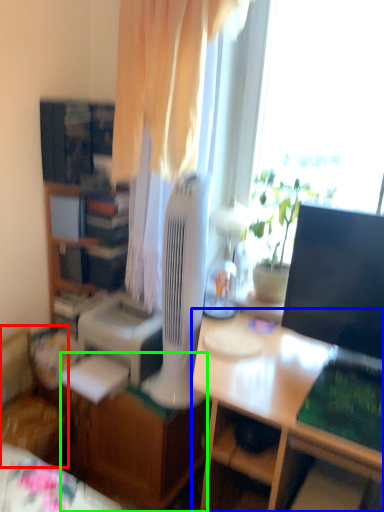
Question: Which object is positioned closest to chair (highlighted by a red box)? Select from desk (highlighted by a blue box) and desk (highlighted by a green box).

Choices:
 (A) desk
 (B) desk

Answer: (B)